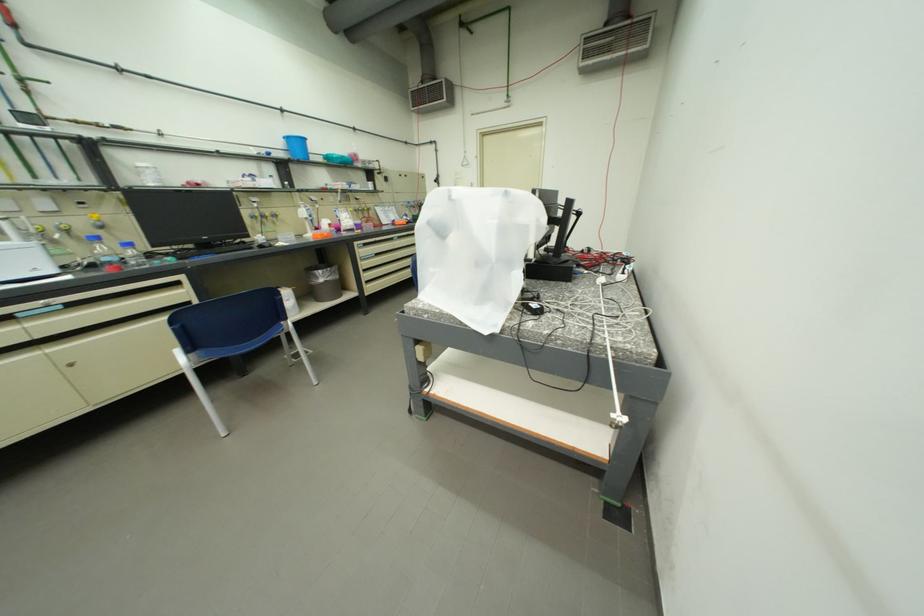
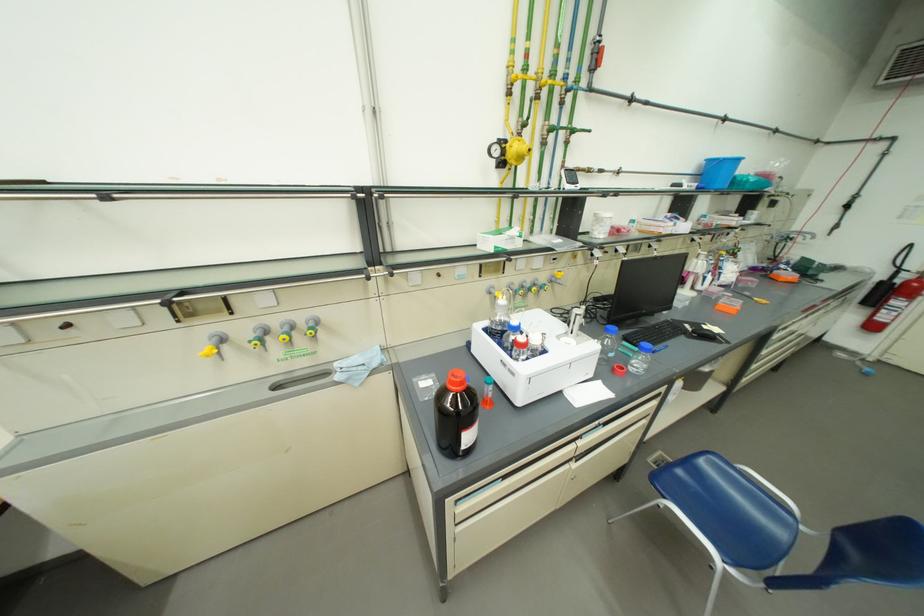
Where in the second image is the point corresponding to [295,143] from the first image?

(712, 164)